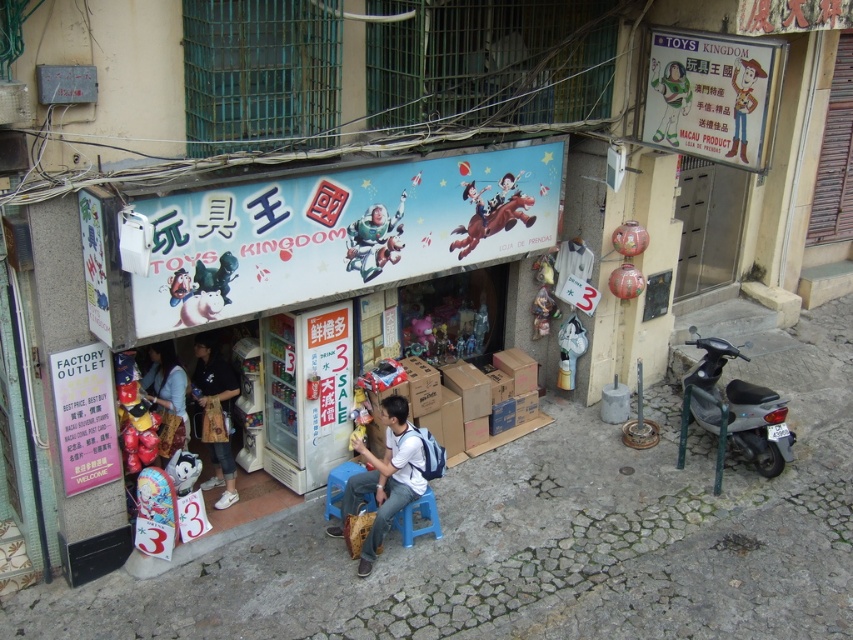
Question: Which object is farther from the camera taking this photo?

Choices:
 (A) matte blue shirt at center
 (B) black cotton shirt at center
 (C) metallic gray scooter at right
 (D) matte plastic cowboy figure at upper right

Answer: (C)

Question: Which point is farther from the camera taking this photo?

Choices:
 (A) (389, 225)
 (B) (714, 381)
 (C) (196, 353)
 (D) (364, 486)

Answer: (B)

Question: Is white fabric shirt at center positioned before matte blue shirt at center?

Choices:
 (A) yes
 (B) no

Answer: (A)

Question: Can you confirm if matte blue shirt at center is thinner than matte blue spacesuit at center?

Choices:
 (A) no
 (B) yes

Answer: (B)

Question: Does black cotton shirt at center have a greater width compared to matte blue spacesuit at center?

Choices:
 (A) no
 (B) yes

Answer: (A)

Question: Based on their relative distances, which object is nearer to the black cotton shirt at center?

Choices:
 (A) white fabric shirt at center
 (B) matte plastic cowboy figure at upper right
 (C) matte plastic buzz lightyear at upper right

Answer: (A)